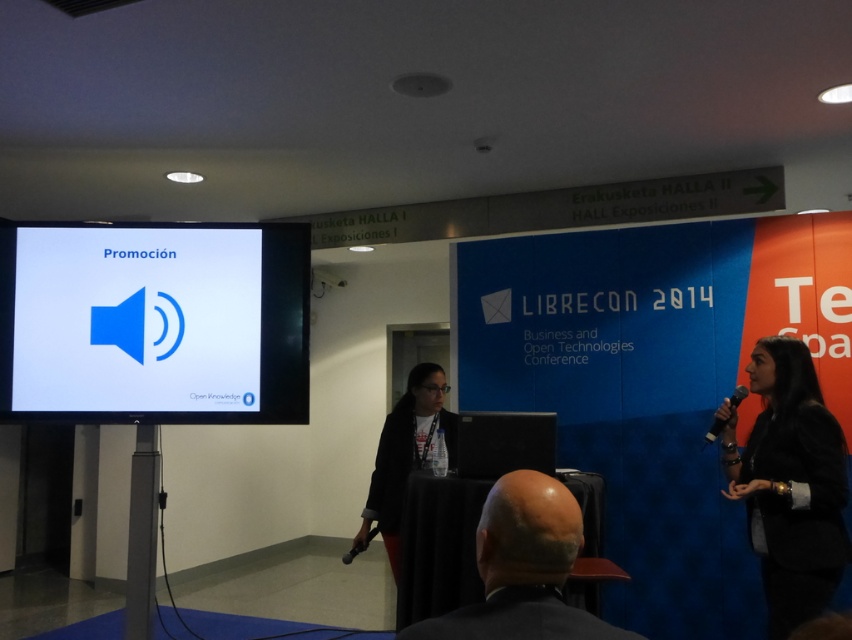
You are an event organizer who needs to set up a banner that will cover the white glossy projector screen at left and the black leather jacket at right. Which object requires a larger banner in terms of width?

The white glossy projector screen at left requires a larger banner because it is wider than the black leather jacket at right.

In the conference room scene, there are two people and a point labeled at coordinates (153,323). What object is located at that point?

The point at coordinates (153,323) indicates the white glossy projector screen at left.